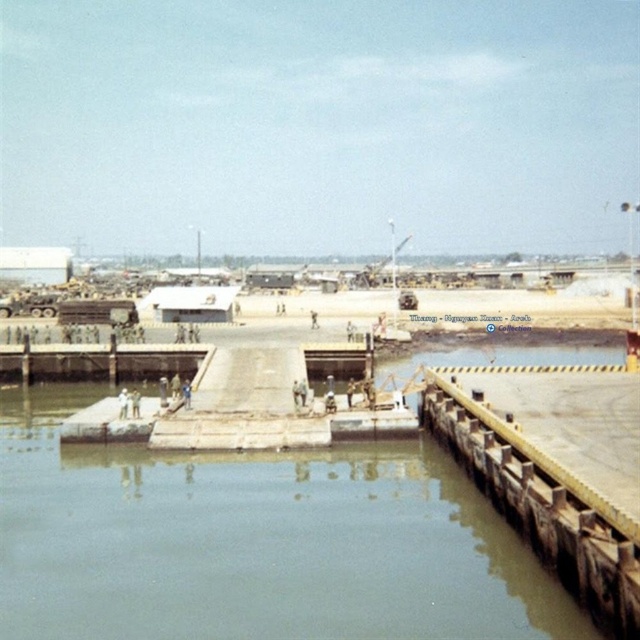
Can you confirm if clear water at center is smaller than wooden dock at lower right?

Actually, clear water at center might be larger than wooden dock at lower right.

Can you confirm if clear water at center is shorter than wooden dock at lower right?

Indeed, clear water at center has a lesser height compared to wooden dock at lower right.

Describe the element at coordinates (253, 541) in the screenshot. I see `clear water at center` at that location.

Find the location of a particular element. clear water at center is located at coordinates (253, 541).